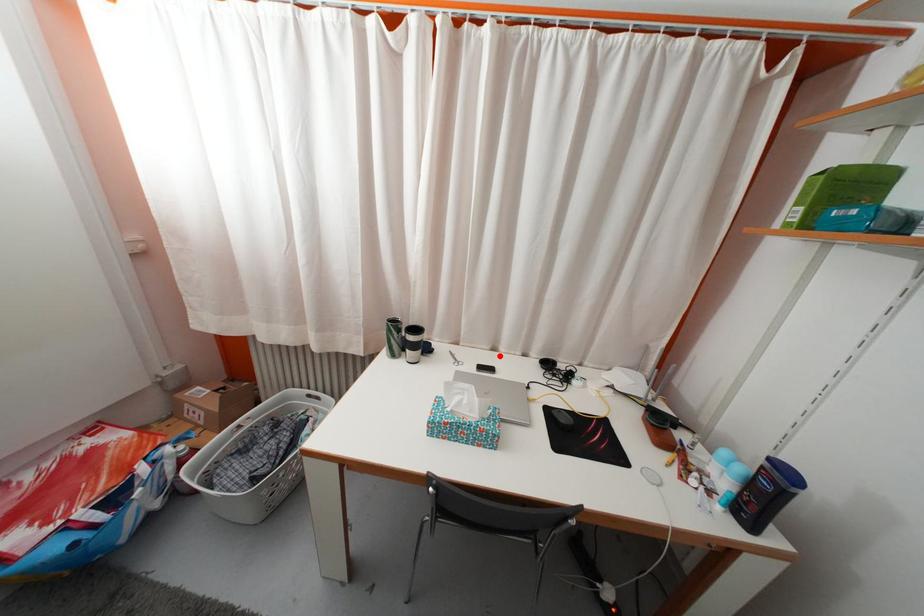
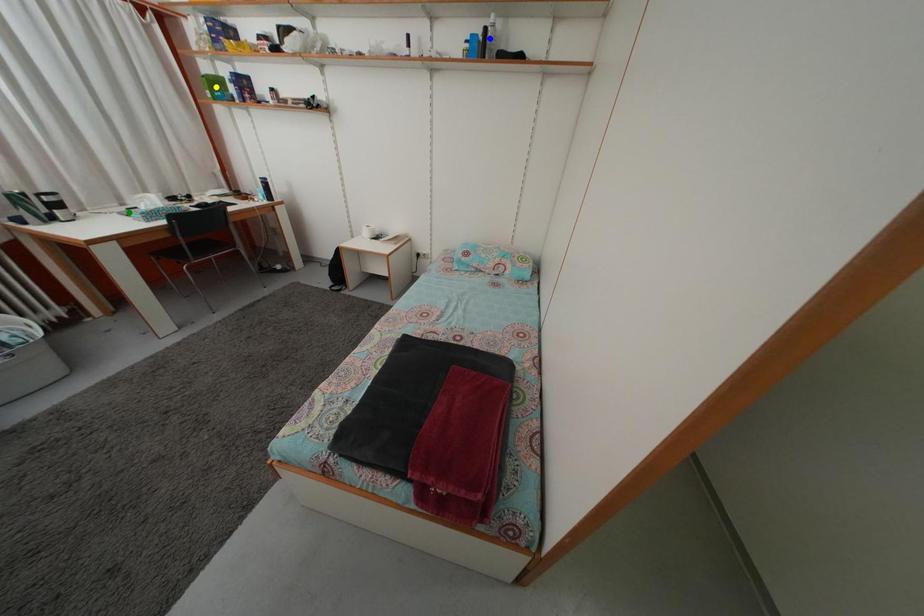
Question: I am providing you with two images of the same scene from different viewpoints. A red point is marked on the first image. You are given multiple points on the second image. Can you choose the point in image 2 that corresponds to the point in image 1?

Choices:
 (A) yellow point
 (B) green point
 (C) blue point

Answer: (B)